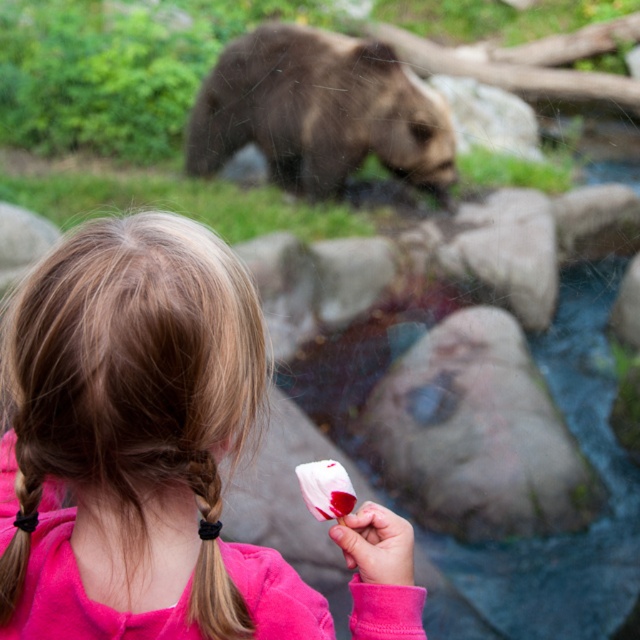
The young girl is holding a pink fabric ice cream at center and has a black rubber band at back. Which object is positioned more to the left?

The pink fabric ice cream at center is positioned to the left of the black rubber band at back.

You are a zookeeper at this wildlife park and need to ensure the safety of the visitors. The brown fuzzy bear at upper center and the black rubber band at back are both within the visitor area. Which object is closer to the girl holding the ice cream bar?

The brown fuzzy bear at upper center is closer to the girl holding the ice cream bar because it is positioned on the right side of the black rubber band at back, which is located further away.